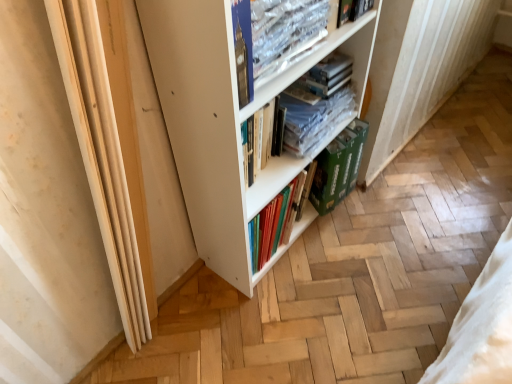
Find the location of a particular element. The height and width of the screenshot is (384, 512). free space above clear plastic books at center, the 3th book from the front (from a real-world perspective) is located at coordinates (313, 102).